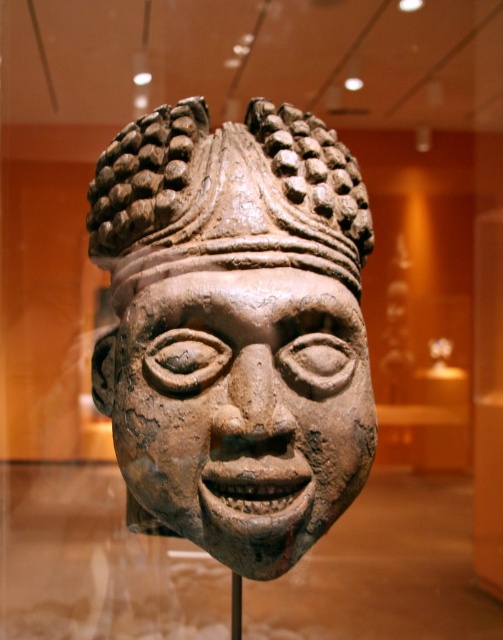
What object is located at the coordinates point [241,410] in the image?

The point [241,410] corresponds to the brown clay mask at center.

You are an archaeologist examining the ancient terracotta head. You notice the brown clay mask at center and the earthy clay headdress at center. Which object is located above the other?

The earthy clay headdress at center is above the brown clay mask at center because the brown clay mask at center is positioned under it.